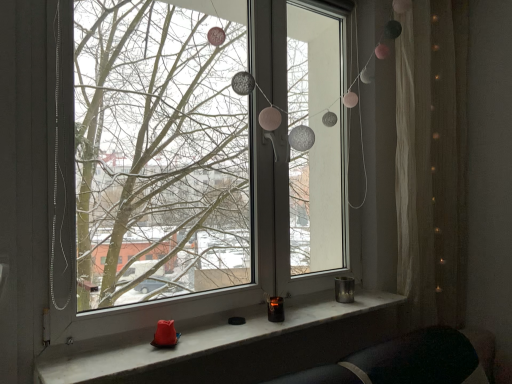
Question: From a real-world perspective, is white sheer curtain at right physically located above or below white marble window sill at lower center?

Choices:
 (A) below
 (B) above

Answer: (B)

Question: Is point (412, 160) closer or farther from the camera than point (321, 299)?

Choices:
 (A) closer
 (B) farther

Answer: (B)

Question: Estimate the real-world distances between objects in this image. Which object is closer to the white marble window sill at lower center?

Choices:
 (A) white sheer curtain at right
 (B) transparent glass window at center

Answer: (A)

Question: Which is nearer to the transparent glass window at center?

Choices:
 (A) white marble window sill at lower center
 (B) white sheer curtain at right

Answer: (B)